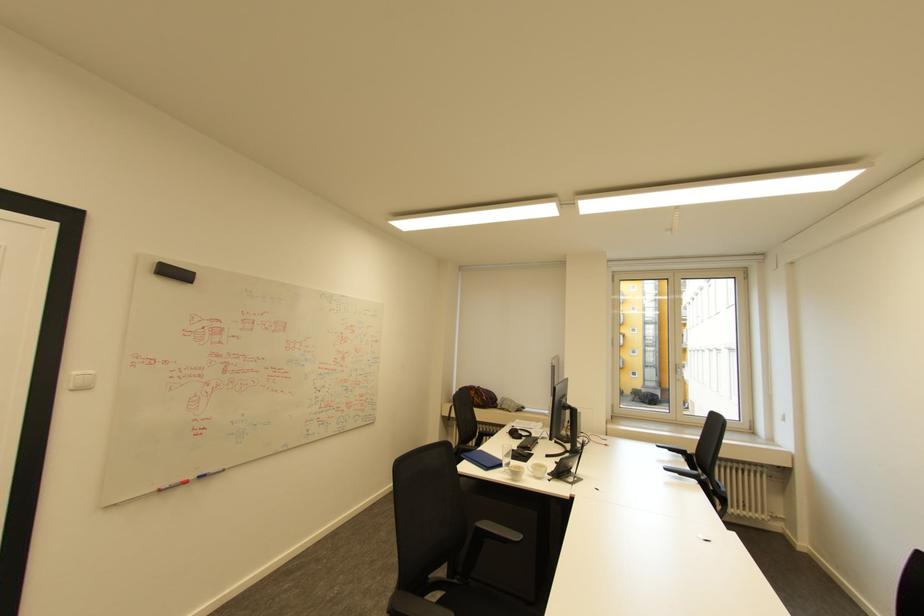
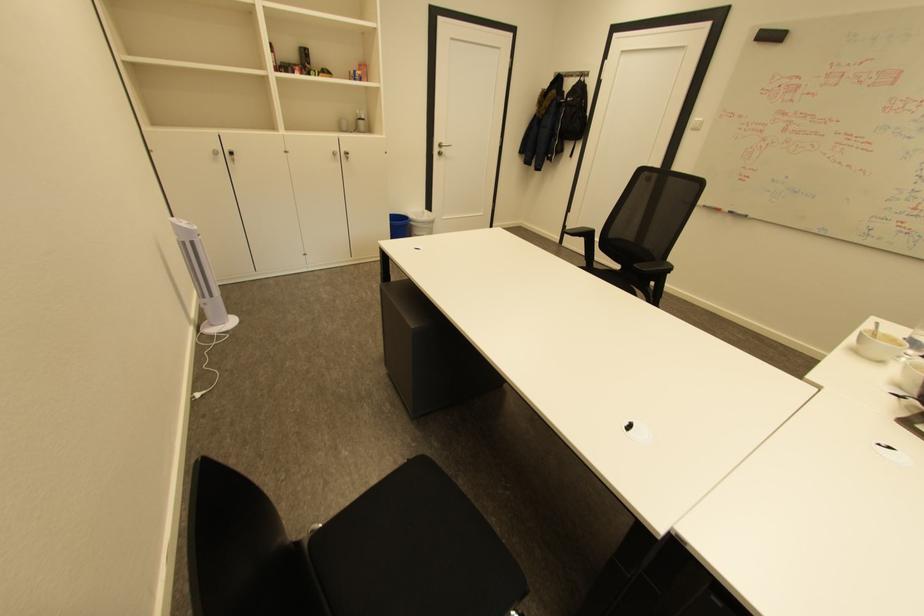
Find the pixel in the second image that matches the point at 207,477 in the first image.

(737, 212)